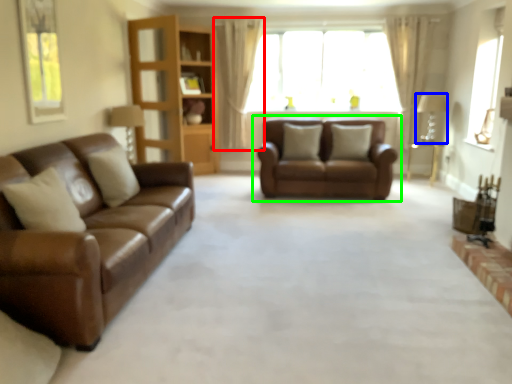
Question: Which object is the closest to the curtain (highlighted by a red box)? Choose among these: lamp (highlighted by a blue box) or studio couch (highlighted by a green box).

Choices:
 (A) lamp
 (B) studio couch

Answer: (B)